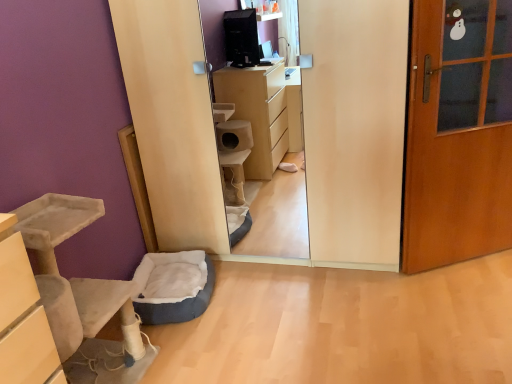
Question: Does beige suede cat tree at lower left have a larger size compared to wooden door at right?

Choices:
 (A) yes
 (B) no

Answer: (A)

Question: Is beige suede cat tree at lower left to the left of wooden door at right from the viewer's perspective?

Choices:
 (A) no
 (B) yes

Answer: (B)

Question: Considering the relative sizes of beige suede cat tree at lower left and wooden door at right in the image provided, is beige suede cat tree at lower left shorter than wooden door at right?

Choices:
 (A) no
 (B) yes

Answer: (B)

Question: Is beige suede cat tree at lower left to the right of wooden door at right from the viewer's perspective?

Choices:
 (A) yes
 (B) no

Answer: (B)

Question: Considering the relative positions of beige suede cat tree at lower left and wooden door at right in the image provided, is beige suede cat tree at lower left behind wooden door at right?

Choices:
 (A) no
 (B) yes

Answer: (A)

Question: In the image, is blue fabric pet bed at lower left positioned in front of or behind beige suede cat tree at lower left?

Choices:
 (A) behind
 (B) front

Answer: (A)

Question: Based on their sizes in the image, would you say blue fabric pet bed at lower left is bigger or smaller than beige suede cat tree at lower left?

Choices:
 (A) small
 (B) big

Answer: (A)

Question: Is point (202, 309) positioned closer to the camera than point (104, 301)?

Choices:
 (A) farther
 (B) closer

Answer: (A)

Question: From the image's perspective, is blue fabric pet bed at lower left positioned above or below beige suede cat tree at lower left?

Choices:
 (A) below
 (B) above

Answer: (A)

Question: Is wooden door at right taller or shorter than beige suede cat tree at lower left?

Choices:
 (A) short
 (B) tall

Answer: (B)

Question: From the image's perspective, is wooden door at right positioned above or below beige suede cat tree at lower left?

Choices:
 (A) above
 (B) below

Answer: (A)

Question: Considering the positions of point (437, 28) and point (47, 278), is point (437, 28) closer or farther from the camera than point (47, 278)?

Choices:
 (A) closer
 (B) farther

Answer: (B)

Question: Is wooden door at right in front of or behind beige suede cat tree at lower left in the image?

Choices:
 (A) front
 (B) behind

Answer: (B)

Question: Is beige suede cat tree at lower left situated inside wooden door at right or outside?

Choices:
 (A) inside
 (B) outside

Answer: (B)

Question: Is beige suede cat tree at lower left taller or shorter than wooden door at right?

Choices:
 (A) tall
 (B) short

Answer: (B)